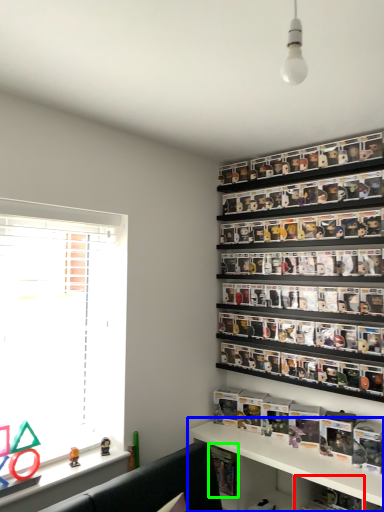
Question: Considering the real-world distances, which object is closest to cabinet (highlighted by a red box)? shelf (highlighted by a blue box) or book (highlighted by a green box).

Choices:
 (A) shelf
 (B) book

Answer: (A)